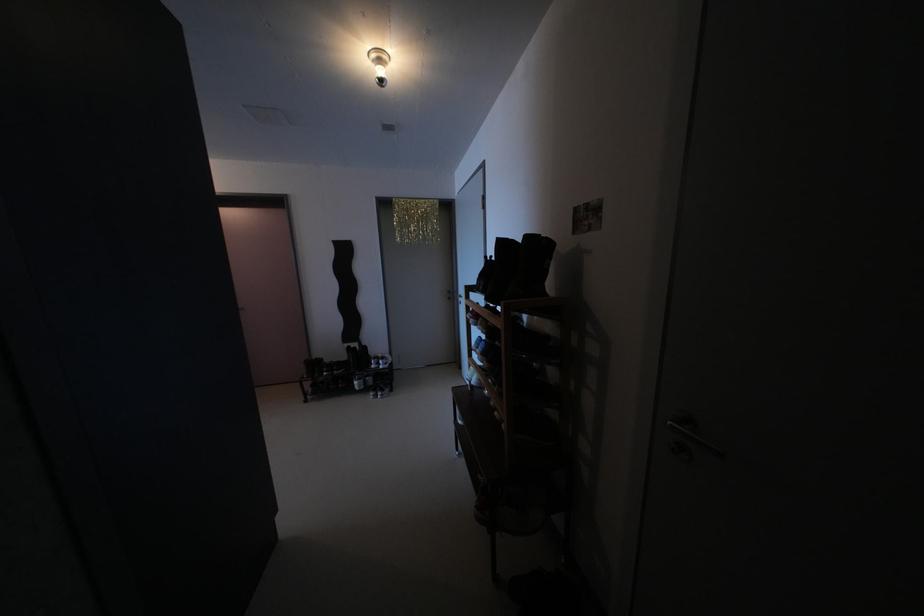
Find where to turn the ceiling lightbulb. Please return your answer as a coordinate pair (x, y).

(379, 63)